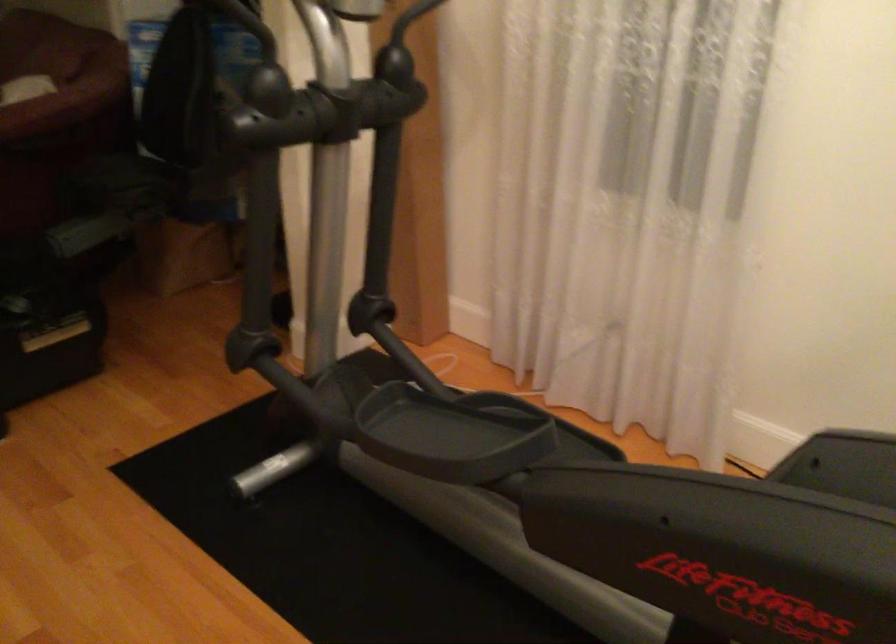
The width and height of the screenshot is (896, 644). I want to click on elliptical machine handle, so click(731, 625).